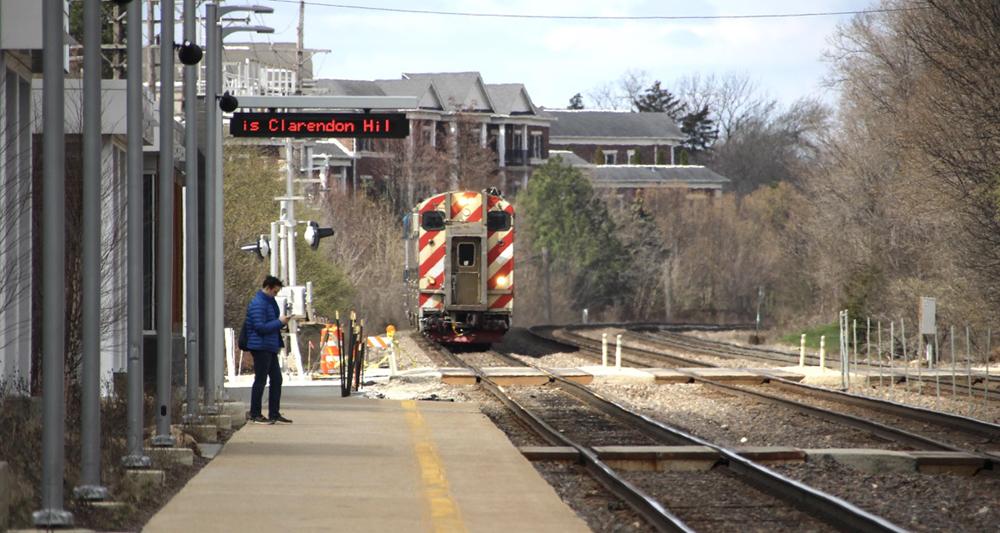
The image size is (1000, 533). Find the location of `door`. door is located at coordinates tap(468, 289).